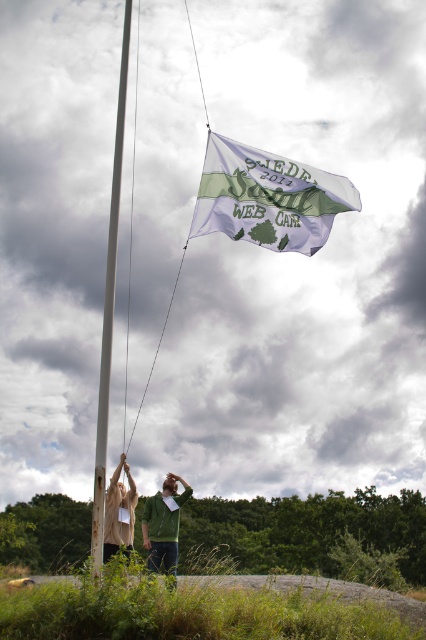
You are a park ranger who needs to secure a 6 meter long safety rope between the smooth white pole at center and the green cotton hoodie at center. Based on the scene, will the rope be long enough?

The distance between the smooth white pole at center and the green cotton hoodie at center is 5.55 meters. Since the rope is 6 meters long, it will be long enough to secure between them.

In the scene where two people are raising a flag on a pole in a cloudy outdoor setting, there is a point marked at coordinates (267, 196). What object is located at this point?

The point at (267, 196) marks the white fabric flag at upper center.

You are a photographer positioned at the base of the flagpole. You want to take a photo that includes both the white fabric flag at upper center and the green cotton hoodie at center. Based on their positions, which object will appear larger in your photo?

The white fabric flag at upper center is closer to the viewer than the green cotton hoodie at center, so it will appear larger in the photo.